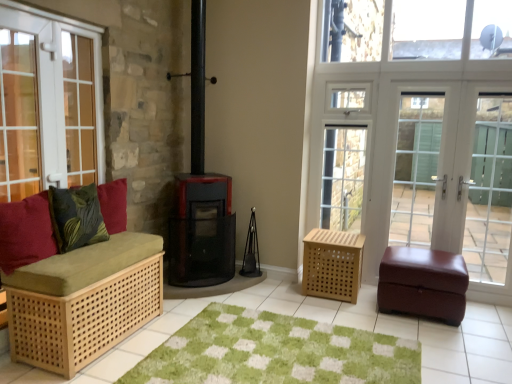
You are a GUI agent. You are given a task and a screenshot of the screen. Output one action in this format:
    pyautogui.click(x=<x>, y=<y>)
    Task: Click on the free spot in front of velvety green pillow at left, the first pillow when ordered from back to front
    
    Given the screenshot: What is the action you would take?
    pyautogui.click(x=72, y=257)